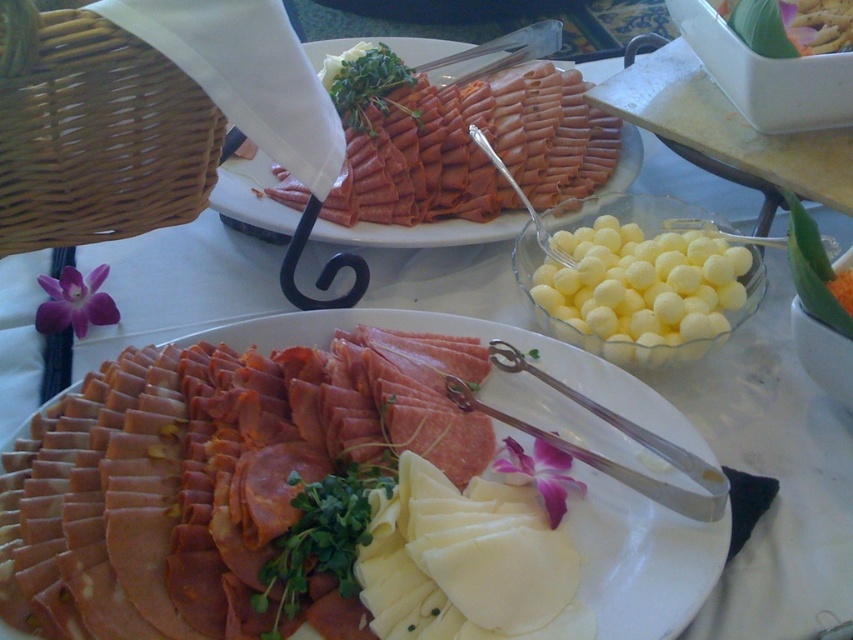
Question: Estimate the real-world distances between objects in this image. Which object is closer to the sliced meat at center?

Choices:
 (A) yellow matte cheese balls at center
 (B) green leafy vegetable at upper right
 (C) sliced cured meat at upper center
 (D) white creamy cheese at center

Answer: (D)

Question: Observing the image, what is the correct spatial positioning of sliced cured meat at upper center in reference to green leafy vegetable at upper right?

Choices:
 (A) left
 (B) right

Answer: (A)

Question: Among these objects, which one is nearest to the camera?

Choices:
 (A) white creamy cheese at center
 (B) sliced meat at center

Answer: (B)

Question: Which object is positioned farthest from the sliced cured meat at upper center?

Choices:
 (A) green leafy vegetable at upper right
 (B) sliced meat at center
 (C) yellow matte cheese balls at center
 (D) white creamy cheese at center

Answer: (D)

Question: Does yellow matte cheese balls at center appear under green leafy vegetable at upper right?

Choices:
 (A) yes
 (B) no

Answer: (A)

Question: Does white creamy cheese at center appear over green leafy vegetable at upper right?

Choices:
 (A) yes
 (B) no

Answer: (B)